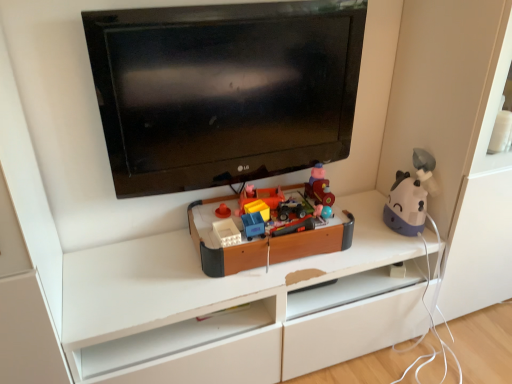
What is the approximate width of wooden toy train at center, which ranks as the second toy in right-to-left order?

4.95 inches.

In order to face purple matte humidifier at right, which appears as the first toy when viewed from the right, should I rotate leftwards or rightwards?

To face it directly, rotate right by 19.659 degrees.

What do you see at coordinates (411, 196) in the screenshot? The width and height of the screenshot is (512, 384). I see `purple matte humidifier at right, which ranks as the 3th toy in left-to-right order` at bounding box center [411, 196].

You are a GUI agent. You are given a task and a screenshot of the screen. Output one action in this format:
    pyautogui.click(x=<x>, y=<y>)
    Task: Click on the wooden toy train at center, the second toy viewed from the left
    The image size is (512, 384).
    Given the screenshot: What is the action you would take?
    (319, 186)

Is wooden toy train at center, the second toy viewed from the left, to the left or to the right of black glossy tv at upper center in the image?

From the image, it's evident that wooden toy train at center, the second toy viewed from the left, is to the right of black glossy tv at upper center.

Between wooden toy train at center, the second toy viewed from the left, and black glossy tv at upper center, which one is positioned in front?

black glossy tv at upper center is in front.

From a real-world perspective, does wooden toy train at center, the second toy viewed from the left, stand above black glossy tv at upper center?

Actually, wooden toy train at center, the second toy viewed from the left, is physically below black glossy tv at upper center in the real world.

Is wooden toy train at center, the second toy viewed from the left, at the right side of purple matte humidifier at right, which ranks as the 3th toy in left-to-right order?

Incorrect, wooden toy train at center, the second toy viewed from the left, is not on the right side of purple matte humidifier at right, which ranks as the 3th toy in left-to-right order.

From the image's perspective, which is above, wooden toy train at center, which ranks as the second toy in right-to-left order, or purple matte humidifier at right, which ranks as the 3th toy in left-to-right order?

wooden toy train at center, which ranks as the second toy in right-to-left order, from the image's perspective.

Considering the relative sizes of wooden toy train at center, the second toy viewed from the left, and purple matte humidifier at right, which ranks as the 3th toy in left-to-right order, in the image provided, is wooden toy train at center, the second toy viewed from the left, wider than purple matte humidifier at right, which ranks as the 3th toy in left-to-right order,?

Incorrect, the width of wooden toy train at center, the second toy viewed from the left, does not surpass that of purple matte humidifier at right, which ranks as the 3th toy in left-to-right order.

From a real-world perspective, is wooden toy train at center, the second toy viewed from the left, above or below purple matte humidifier at right, which appears as the first toy when viewed from the right?

From a real-world perspective, wooden toy train at center, the second toy viewed from the left, is physically above purple matte humidifier at right, which appears as the first toy when viewed from the right.

Looking at this image, from a real-world perspective, is purple matte humidifier at right, which appears as the first toy when viewed from the right, located beneath black glossy tv at upper center?

Indeed, from a real-world perspective, purple matte humidifier at right, which appears as the first toy when viewed from the right, is positioned beneath black glossy tv at upper center.

Is point (406, 184) positioned in front of point (231, 156)?

No, (406, 184) is further to viewer.

Are purple matte humidifier at right, which ranks as the 3th toy in left-to-right order, and black glossy tv at upper center far apart?

Actually, purple matte humidifier at right, which ranks as the 3th toy in left-to-right order, and black glossy tv at upper center are a little close together.

Is black glossy tv at upper center a part of purple matte humidifier at right, which ranks as the 3th toy in left-to-right order?

No.

Based on the photo, considering the sizes of objects black glossy tv at upper center and wooden toy box at center, arranged as the first toy when viewed from the left, in the image provided, who is bigger, black glossy tv at upper center or wooden toy box at center, arranged as the first toy when viewed from the left,?

black glossy tv at upper center.

Is black glossy tv at upper center shorter than wooden toy box at center, which is the third toy from right to left?

In fact, black glossy tv at upper center may be taller than wooden toy box at center, which is the third toy from right to left.

Is black glossy tv at upper center far away from wooden toy box at center, which is the third toy from right to left?

No.

From the image's perspective, would you say black glossy tv at upper center is positioned over wooden toy box at center, arranged as the first toy when viewed from the left?

Correct, black glossy tv at upper center appears higher than wooden toy box at center, arranged as the first toy when viewed from the left, in the image.

Which is closer, (239, 251) or (211, 123)?

The point (239, 251) is closer to the camera.

Considering the sizes of objects wooden toy box at center, which is the third toy from right to left, and black glossy tv at upper center in the image provided, who is bigger, wooden toy box at center, which is the third toy from right to left, or black glossy tv at upper center?

black glossy tv at upper center is bigger.

Which is more to the right, wooden toy box at center, arranged as the first toy when viewed from the left, or black glossy tv at upper center?

wooden toy box at center, arranged as the first toy when viewed from the left, is more to the right.

Considering the sizes of wooden toy box at center, arranged as the first toy when viewed from the left, and black glossy tv at upper center in the image, is wooden toy box at center, arranged as the first toy when viewed from the left, wider or thinner than black glossy tv at upper center?

In the image, wooden toy box at center, arranged as the first toy when viewed from the left, appears to be wider than black glossy tv at upper center.

The height and width of the screenshot is (384, 512). Find the location of `toy below the purple matte humidifier at right, which ranks as the 3th toy in left-to-right order (from a real-world perspective)`. toy below the purple matte humidifier at right, which ranks as the 3th toy in left-to-right order (from a real-world perspective) is located at coordinates (271, 228).

Between wooden toy box at center, which is the third toy from right to left, and purple matte humidifier at right, which ranks as the 3th toy in left-to-right order, which one has smaller size?

purple matte humidifier at right, which ranks as the 3th toy in left-to-right order, is smaller.

From a real-world perspective, which object rests below the other?

wooden toy box at center, arranged as the first toy when viewed from the left, from a real-world perspective.

Is wooden toy box at center, arranged as the first toy when viewed from the left, looking in the opposite direction of purple matte humidifier at right, which appears as the first toy when viewed from the right?

Absolutely, wooden toy box at center, arranged as the first toy when viewed from the left, is directed away from purple matte humidifier at right, which appears as the first toy when viewed from the right.

From a real-world perspective, which is physically above, black glossy tv at upper center or purple matte humidifier at right, which ranks as the 3th toy in left-to-right order?

black glossy tv at upper center, from a real-world perspective.

Which is farther, (308, 30) or (405, 183)?

Positioned behind is point (405, 183).

Can we say black glossy tv at upper center lies outside purple matte humidifier at right, which ranks as the 3th toy in left-to-right order?

black glossy tv at upper center lies outside purple matte humidifier at right, which ranks as the 3th toy in left-to-right order,'s area.

How distant is black glossy tv at upper center from purple matte humidifier at right, which ranks as the 3th toy in left-to-right order?

black glossy tv at upper center is 22.64 inches from purple matte humidifier at right, which ranks as the 3th toy in left-to-right order.

This screenshot has width=512, height=384. In order to click on the 2nd toy to the right when counting from the black glossy tv at upper center in this screenshot , I will do `click(319, 186)`.

Starting from the wooden toy train at center, the second toy viewed from the left, which toy is the 1st one in front? Please provide its 2D coordinates.

[(411, 196)]

Which object lies nearer to the anchor point black glossy tv at upper center, wooden toy box at center, arranged as the first toy when viewed from the left, or purple matte humidifier at right, which ranks as the 3th toy in left-to-right order?

wooden toy box at center, arranged as the first toy when viewed from the left, is closer to black glossy tv at upper center.

Based on the photo, estimate the real-world distances between objects in this image. Which object is further from black glossy tv at upper center, wooden toy train at center, the second toy viewed from the left, or purple matte humidifier at right, which ranks as the 3th toy in left-to-right order?

Among the two, purple matte humidifier at right, which ranks as the 3th toy in left-to-right order, is located further to black glossy tv at upper center.

Looking at the image, which one is located further to black glossy tv at upper center, wooden toy box at center, arranged as the first toy when viewed from the left, or wooden toy train at center, the second toy viewed from the left?

Among the two, wooden toy train at center, the second toy viewed from the left, is located further to black glossy tv at upper center.

From the image, which object appears to be farther from wooden toy box at center, which is the third toy from right to left, black glossy tv at upper center or wooden toy train at center, the second toy viewed from the left?

Based on the image, black glossy tv at upper center appears to be further to wooden toy box at center, which is the third toy from right to left.

Consider the image. Which object lies further to the anchor point purple matte humidifier at right, which ranks as the 3th toy in left-to-right order, wooden toy box at center, arranged as the first toy when viewed from the left, or wooden toy train at center, which ranks as the second toy in right-to-left order?

wooden toy box at center, arranged as the first toy when viewed from the left.

Which object lies nearer to the anchor point wooden toy train at center, the second toy viewed from the left, black glossy tv at upper center or wooden toy box at center, which is the third toy from right to left?

The object closer to wooden toy train at center, the second toy viewed from the left, is wooden toy box at center, which is the third toy from right to left.

Based on the photo, from the image, which object appears to be nearer to wooden toy box at center, arranged as the first toy when viewed from the left, wooden toy train at center, the second toy viewed from the left, or purple matte humidifier at right, which ranks as the 3th toy in left-to-right order?

wooden toy train at center, the second toy viewed from the left.

Looking at the image, which one is located further to black glossy tv at upper center, wooden toy train at center, the second toy viewed from the left, or wooden toy box at center, arranged as the first toy when viewed from the left?

wooden toy train at center, the second toy viewed from the left.

The width and height of the screenshot is (512, 384). I want to click on toy situated between wooden toy box at center, which is the third toy from right to left, and purple matte humidifier at right, which ranks as the 3th toy in left-to-right order, from left to right, so click(319, 186).